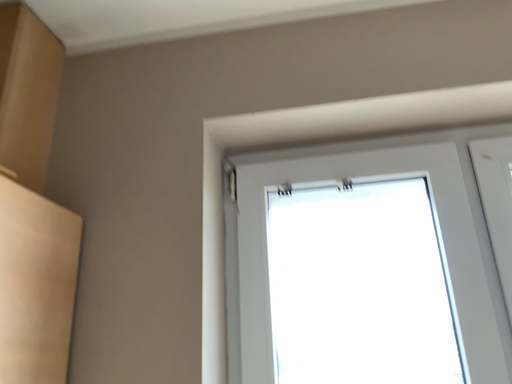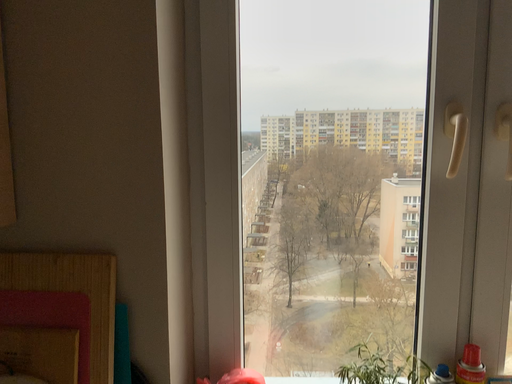
Question: How did the camera likely rotate when shooting the video?

Choices:
 (A) rotated downward
 (B) rotated upward

Answer: (A)